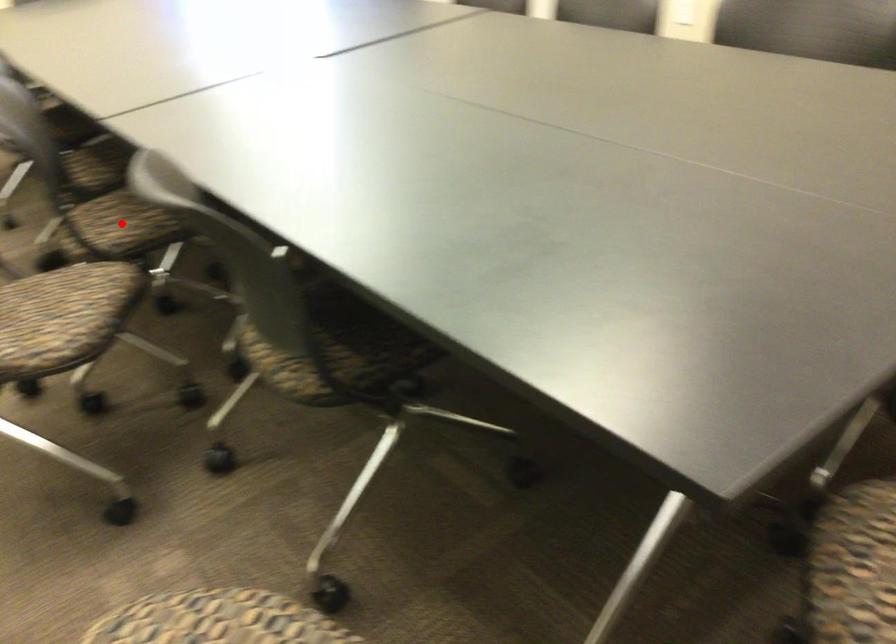
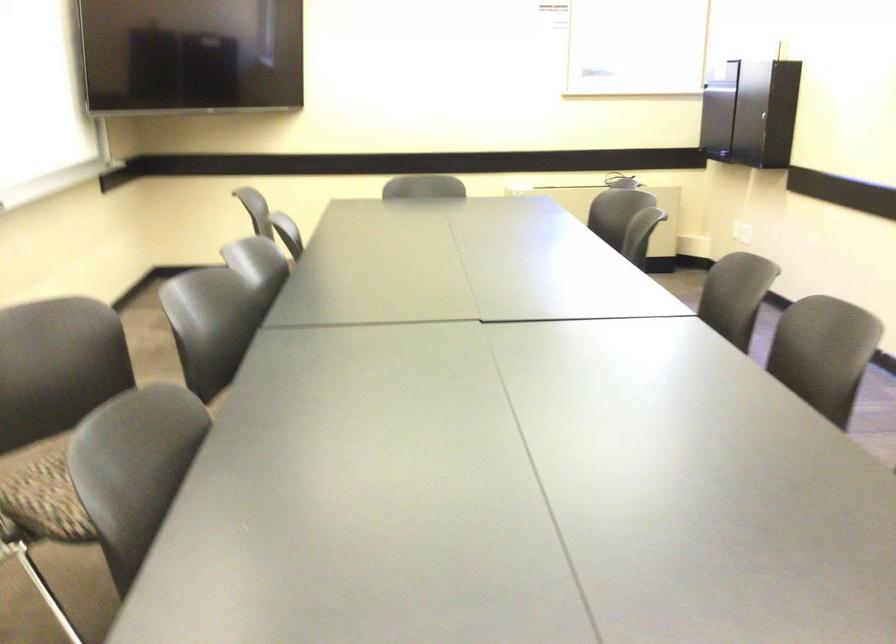
Question: I am providing you with two images of the same scene from different viewpoints. A red point is marked on the first image. Is the red point's position out of view in image 2?

Choices:
 (A) Yes
 (B) No

Answer: (A)